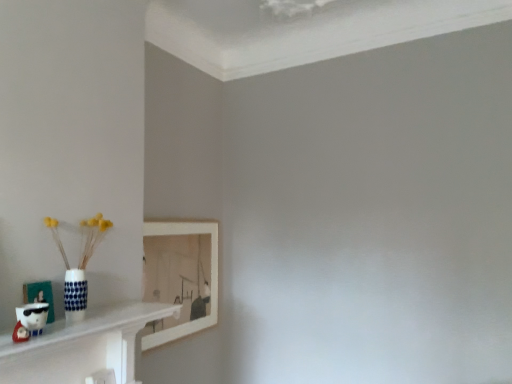
I want to click on white glossy shelf at lower left, so click(81, 346).

What do you see at coordinates (40, 296) in the screenshot?
I see `matte white picture frame at lower left, which is the second picture frame from right to left` at bounding box center [40, 296].

Locate an element on the screen. white wooden picture frame at upper left, which appears as the 1th picture frame when viewed from the right is located at coordinates (180, 277).

In the scene shown: Does white wooden picture frame at upper left, which is the 2th picture frame in front-to-back order, have a smaller size compared to white glossy shelf at lower left?

No.

How different are the orientations of white wooden picture frame at upper left, which is the 2th picture frame in front-to-back order, and white glossy shelf at lower left in degrees?

0.0313 degrees.

From the image's perspective, is white wooden picture frame at upper left, which is the 2th picture frame from left to right, beneath white glossy shelf at lower left?

Yes, from the image's perspective, white wooden picture frame at upper left, which is the 2th picture frame from left to right, is beneath white glossy shelf at lower left.

Would you say white wooden picture frame at upper left, which is the 2th picture frame from left to right, is inside or outside white glossy shelf at lower left?

white wooden picture frame at upper left, which is the 2th picture frame from left to right, is spatially situated outside white glossy shelf at lower left.

From a real-world perspective, is white wooden picture frame at upper left, which is the 2th picture frame in front-to-back order, beneath matte white picture frame at lower left, which is the second picture frame from right to left?

Correct, in the physical world, white wooden picture frame at upper left, which is the 2th picture frame in front-to-back order, is lower than matte white picture frame at lower left, which is the second picture frame from right to left.

Based on their sizes in the image, would you say white wooden picture frame at upper left, which is the 2th picture frame from left to right, is bigger or smaller than matte white picture frame at lower left, the second picture frame positioned from the back?

Clearly, white wooden picture frame at upper left, which is the 2th picture frame from left to right, is larger in size than matte white picture frame at lower left, the second picture frame positioned from the back.

Locate an element on the screen. The image size is (512, 384). picture frame located above the white wooden picture frame at upper left, which appears as the 1th picture frame when viewed from the right (from a real-world perspective) is located at coordinates (40, 296).

Is white wooden picture frame at upper left, which is the 2th picture frame from left to right, in front of or behind matte white picture frame at lower left, which appears as the 1th picture frame when viewed from the left, in the image?

Clearly, white wooden picture frame at upper left, which is the 2th picture frame from left to right, is behind matte white picture frame at lower left, which appears as the 1th picture frame when viewed from the left.

Considering the positions of objects white glossy shelf at lower left and white wooden picture frame at upper left, which is the 2th picture frame from left to right, in the image provided, who is behind, white glossy shelf at lower left or white wooden picture frame at upper left, which is the 2th picture frame from left to right,?

white wooden picture frame at upper left, which is the 2th picture frame from left to right, is further from the camera.

Is white glossy shelf at lower left bigger or smaller than white wooden picture frame at upper left, which is the 2th picture frame in front-to-back order?

Clearly, white glossy shelf at lower left is smaller in size than white wooden picture frame at upper left, which is the 2th picture frame in front-to-back order.

Does point (89, 312) come farther from viewer compared to point (165, 286)?

No, (89, 312) is closer to viewer.

Is white glossy shelf at lower left in contact with white wooden picture frame at upper left, which is the 2th picture frame in front-to-back order?

No.

Would you say white glossy shelf at lower left is part of matte white picture frame at lower left, positioned as the 1th picture frame in front-to-back order,'s contents?

No, matte white picture frame at lower left, positioned as the 1th picture frame in front-to-back order, does not contain white glossy shelf at lower left.

Is point (32, 296) positioned after point (90, 328)?

Yes, point (32, 296) is farther from viewer.

Is matte white picture frame at lower left, which appears as the 1th picture frame when viewed from the left, at the left side of white glossy shelf at lower left?

Indeed, matte white picture frame at lower left, which appears as the 1th picture frame when viewed from the left, is positioned on the left side of white glossy shelf at lower left.

Looking at this image, from the image's perspective, which object appears higher, white glossy shelf at lower left or matte white picture frame at lower left, which appears as the 1th picture frame when viewed from the left?

From the image's view, matte white picture frame at lower left, which appears as the 1th picture frame when viewed from the left, is above.

Is the surface of white glossy shelf at lower left in direct contact with matte white picture frame at lower left, positioned as the 1th picture frame in front-to-back order?

white glossy shelf at lower left and matte white picture frame at lower left, positioned as the 1th picture frame in front-to-back order, are clearly separated.

Is point (30, 285) more distant than point (166, 276)?

No, it is in front of (166, 276).

Is matte white picture frame at lower left, the second picture frame positioned from the back, directly adjacent to white wooden picture frame at upper left, which is the 2th picture frame from left to right?

No, matte white picture frame at lower left, the second picture frame positioned from the back, is not making contact with white wooden picture frame at upper left, which is the 2th picture frame from left to right.

From a real-world perspective, who is located higher, matte white picture frame at lower left, which appears as the 1th picture frame when viewed from the left, or white wooden picture frame at upper left, which ranks as the first picture frame in back-to-front order?

matte white picture frame at lower left, which appears as the 1th picture frame when viewed from the left, is physically above.

You are a GUI agent. You are given a task and a screenshot of the screen. Output one action in this format:
    pyautogui.click(x=<x>, y=<y>)
    Task: Click on the 1st picture frame located above the white glossy shelf at lower left (from a real-world perspective)
    
    Given the screenshot: What is the action you would take?
    pyautogui.click(x=180, y=277)

Where is `picture frame behind the matte white picture frame at lower left, which appears as the 1th picture frame when viewed from the left`? This screenshot has width=512, height=384. picture frame behind the matte white picture frame at lower left, which appears as the 1th picture frame when viewed from the left is located at coordinates (180, 277).

Considering their positions, is matte white picture frame at lower left, which is the second picture frame from right to left, positioned closer to white wooden picture frame at upper left, which is the 2th picture frame from left to right, than white glossy shelf at lower left?

white glossy shelf at lower left is closer to white wooden picture frame at upper left, which is the 2th picture frame from left to right.

From the image, which object appears to be farther from white wooden picture frame at upper left, which is the 2th picture frame in front-to-back order, white glossy shelf at lower left or matte white picture frame at lower left, positioned as the 1th picture frame in front-to-back order?

Among the two, matte white picture frame at lower left, positioned as the 1th picture frame in front-to-back order, is located further to white wooden picture frame at upper left, which is the 2th picture frame in front-to-back order.

Looking at the image, which one is located further to matte white picture frame at lower left, positioned as the 1th picture frame in front-to-back order, white wooden picture frame at upper left, which ranks as the first picture frame in back-to-front order, or white glossy shelf at lower left?

Among the two, white wooden picture frame at upper left, which ranks as the first picture frame in back-to-front order, is located further to matte white picture frame at lower left, positioned as the 1th picture frame in front-to-back order.

Based on their spatial positions, is matte white picture frame at lower left, positioned as the 1th picture frame in front-to-back order, or white wooden picture frame at upper left, which appears as the 1th picture frame when viewed from the right, closer to white glossy shelf at lower left?

matte white picture frame at lower left, positioned as the 1th picture frame in front-to-back order, lies closer to white glossy shelf at lower left than the other object.

Estimate the real-world distances between objects in this image. Which object is closer to white glossy shelf at lower left, white wooden picture frame at upper left, which ranks as the first picture frame in back-to-front order, or matte white picture frame at lower left, positioned as the 1th picture frame in front-to-back order?

matte white picture frame at lower left, positioned as the 1th picture frame in front-to-back order, is positioned closer to the anchor white glossy shelf at lower left.

Looking at the image, which one is located closer to matte white picture frame at lower left, which appears as the 1th picture frame when viewed from the left, white glossy shelf at lower left or white wooden picture frame at upper left, which is the 2th picture frame in front-to-back order?

Result: white glossy shelf at lower left lies closer to matte white picture frame at lower left, which appears as the 1th picture frame when viewed from the left, than the other object.

You are a GUI agent. You are given a task and a screenshot of the screen. Output one action in this format:
    pyautogui.click(x=<x>, y=<y>)
    Task: Click on the picture frame between white glossy shelf at lower left and white wooden picture frame at upper left, which ranks as the first picture frame in back-to-front order, along the z-axis
    This screenshot has height=384, width=512.
    Given the screenshot: What is the action you would take?
    coord(40,296)